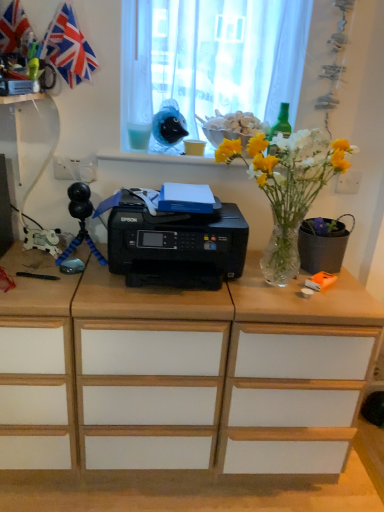
I want to click on vacant space in clear glass vase at center (from a real-world perspective), so click(x=281, y=283).